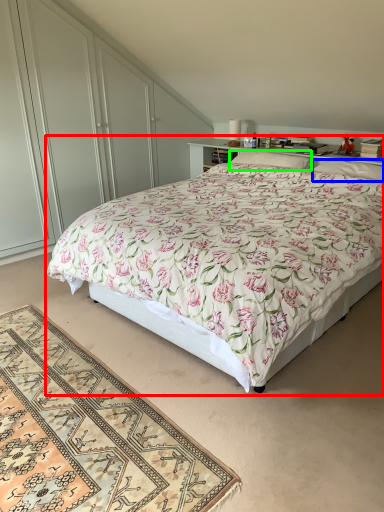
Question: Considering the real-world distances, which object is closest to bed (highlighted by a red box)? pillow (highlighted by a blue box) or pillow (highlighted by a green box).

Choices:
 (A) pillow
 (B) pillow

Answer: (A)